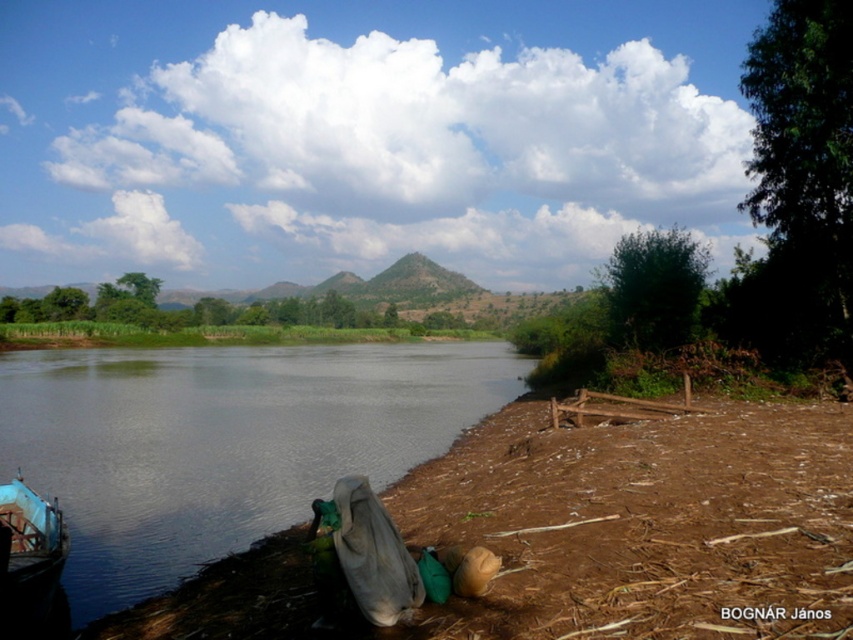
You are a hiker trying to cross the river. You see the brown dirt at lower left and the smooth dark water at lower left. Which one is closer to your current position if you are standing on the riverbank?

The smooth dark water at lower left is closer to your current position because the brown dirt at lower left is to its right, meaning the water is positioned between you and the dirt.

You are a hiker who wants to cross the river using the blue wooden boat at lower left. However, you notice the brown dirt at lower left is blocking the boat. Can you reach the boat without stepping on the dirt?

Answer: The brown dirt at lower left is in front of the blue wooden boat at lower left, meaning the dirt is blocking the boat. To reach the boat without stepping on the dirt, you would need to find an alternative path around it, but based on the scene description, there is no mention of such a path. Therefore, it might not be possible to reach the boat without stepping on the dirt.

You are a kayaker approaching the riverside. You see the smooth dark water at lower left and the blue wooden boat at lower left. Which object is closer to the riverbank on the right side?

The blue wooden boat at lower left is closer to the riverbank on the right side because it is to the right of the smooth dark water at lower left.